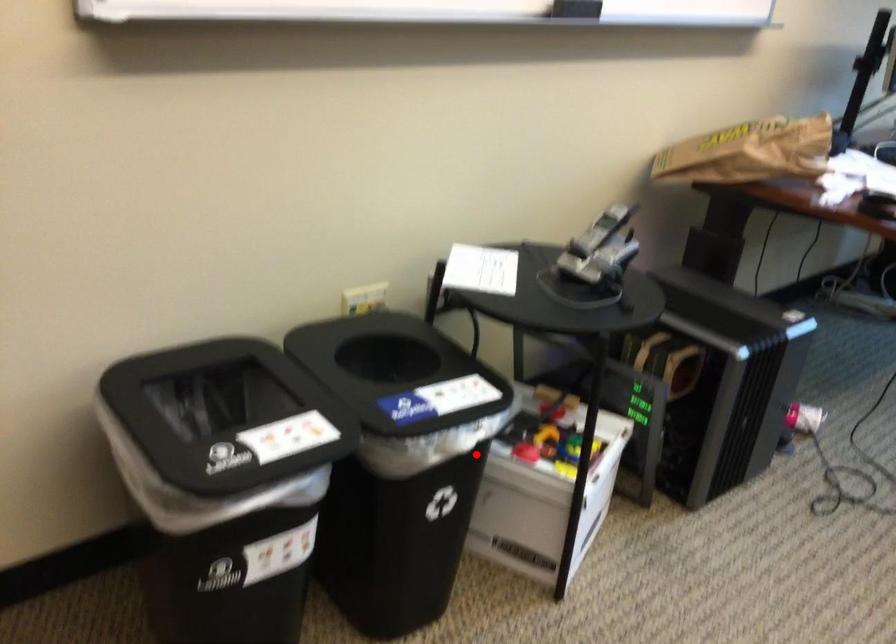
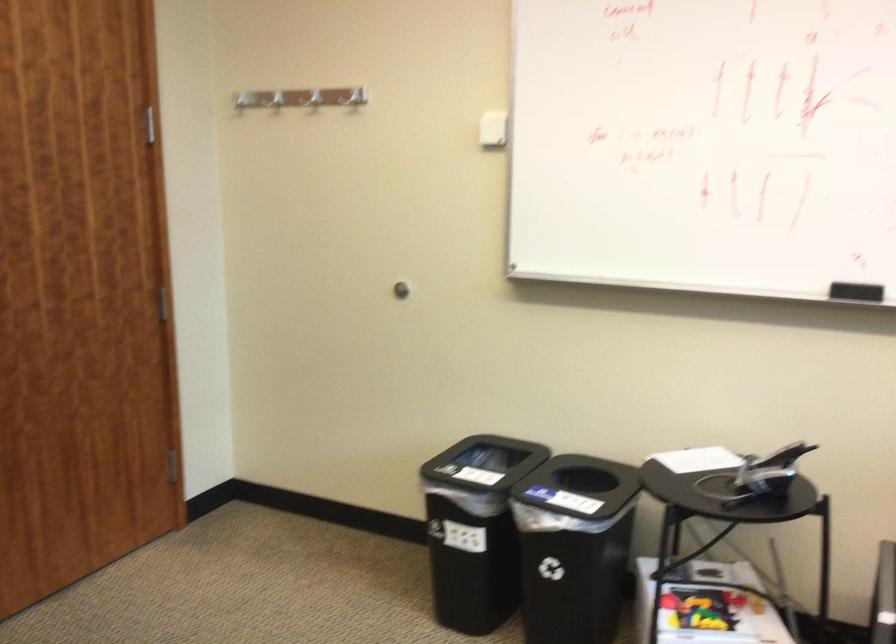
In the second image, find the point that corresponds to the highlighted location in the first image.

(574, 547)